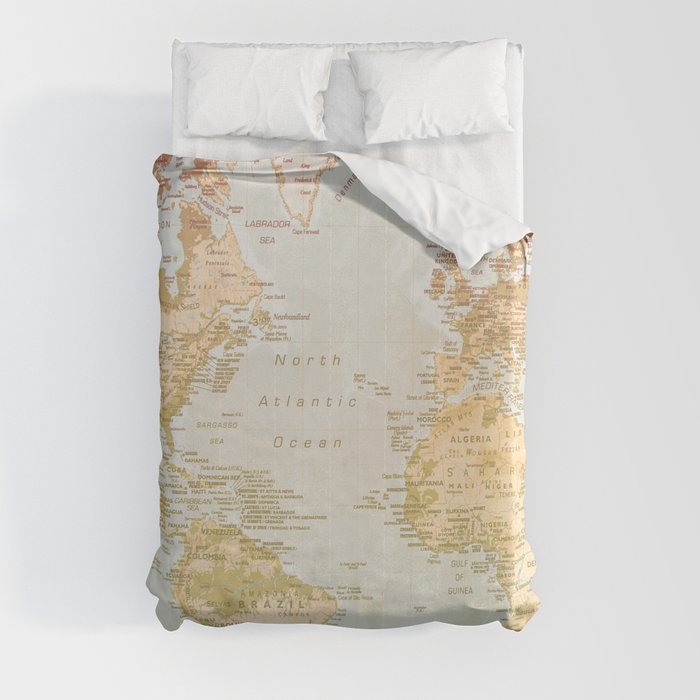
Find any where headboard would be in the picture. Your answer should be formatted as a list of tuples, i.e. [(x1, y1), (x2, y2), ...], where each tuple contains the x and y coordinates of a point satisfying the conditions above.

[(330, 32)]